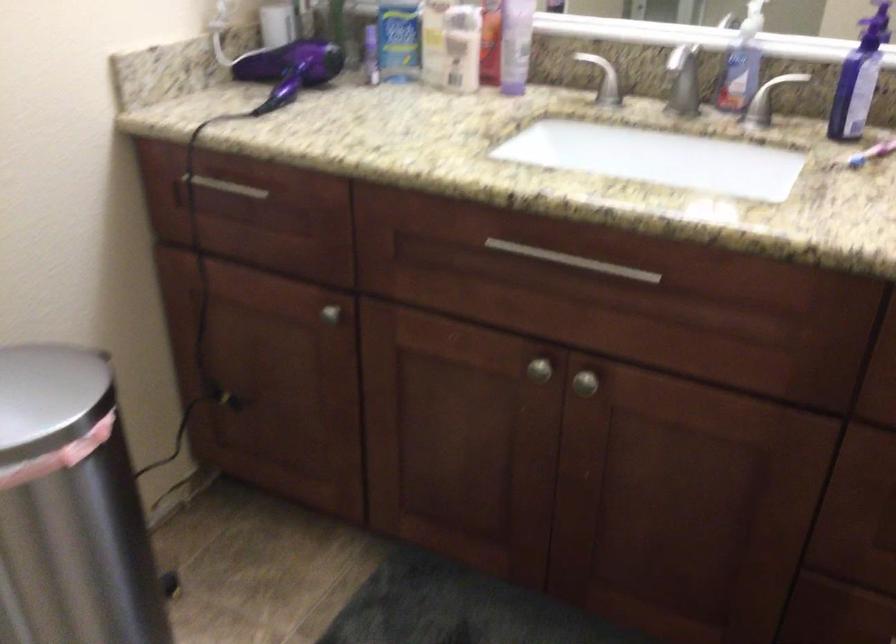
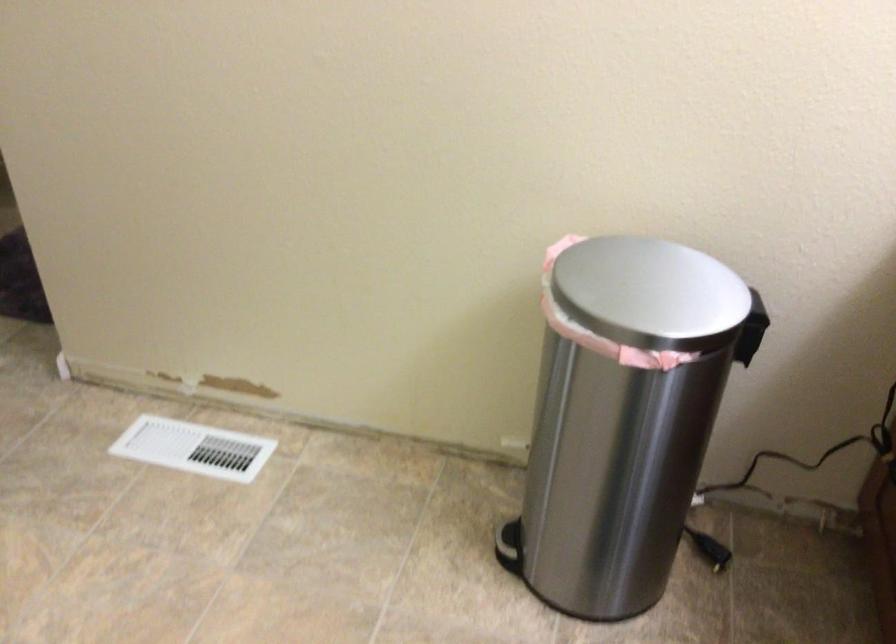
In the second image, find the point that corresponds to (x=161, y=485) in the first image.

(794, 483)